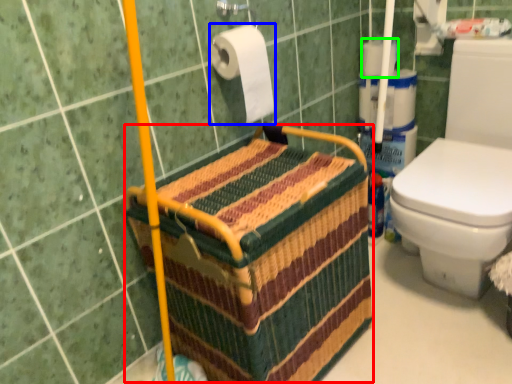
Question: Based on their relative distances, which object is farther from basket (highlighted by a red box)? Choose from toilet paper (highlighted by a blue box) and toilet paper (highlighted by a green box).

Choices:
 (A) toilet paper
 (B) toilet paper

Answer: (B)